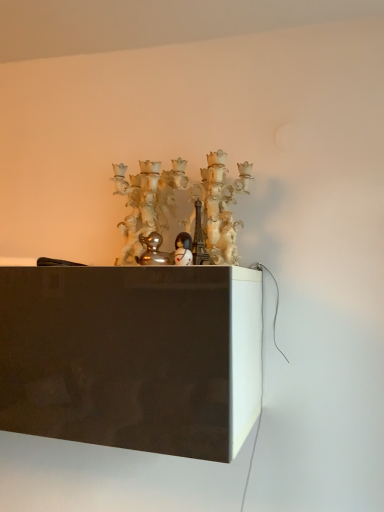
Question: In terms of size, does shiny silver duckling at center, placed as the second toy when sorted from right to left, appear bigger or smaller than white glossy figurine at center, which is the 1th toy in right-to-left order?

Choices:
 (A) small
 (B) big

Answer: (B)

Question: From the image's perspective, is shiny silver duckling at center, which is counted as the 1th toy, starting from the left, located above or below white glossy figurine at center, which is the 1th toy in right-to-left order?

Choices:
 (A) below
 (B) above

Answer: (B)

Question: Based on their relative distances, which object is nearer to the translucent glass chandelier at center?

Choices:
 (A) shiny silver duckling at center, placed as the second toy when sorted from right to left
 (B) white glossy figurine at center, which ranks as the 2th toy in left-to-right order

Answer: (A)

Question: Which of these objects is positioned farthest from the shiny silver duckling at center, which is counted as the 1th toy, starting from the left?

Choices:
 (A) white glossy figurine at center, which is the 1th toy in right-to-left order
 (B) translucent glass chandelier at center

Answer: (B)